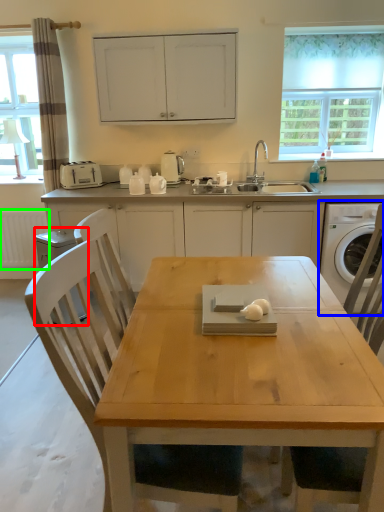
Question: Based on their relative distances, which object is farther from dish washer (highlighted by a red box)? Choose from washing machine (highlighted by a blue box) and radiator (highlighted by a green box).

Choices:
 (A) washing machine
 (B) radiator

Answer: (A)